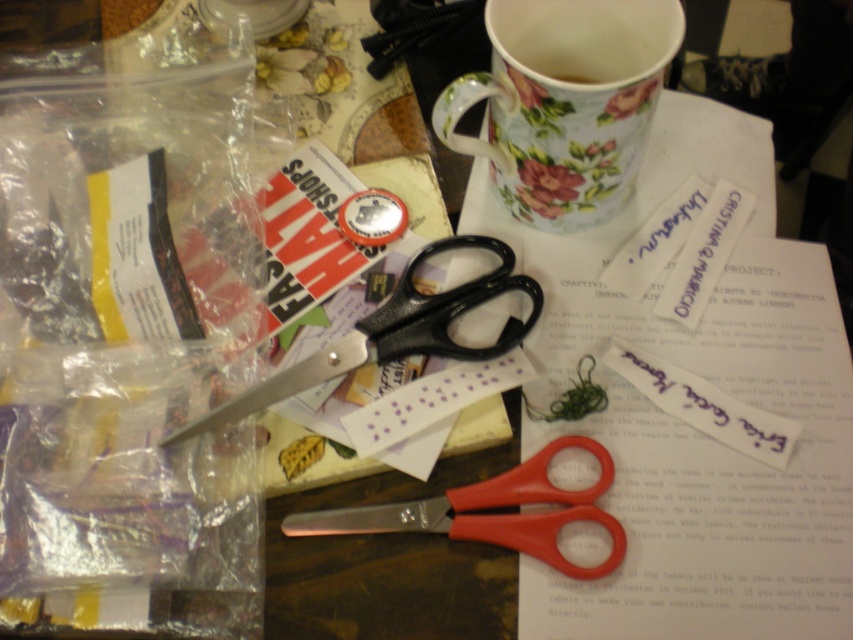
Where is `white paper at upper center`? white paper at upper center is located at coordinates (688, 422).

Between white paper at upper center and floral ceramic mug at upper center, which one is positioned higher?

floral ceramic mug at upper center is above.

Is point (706, 496) closer to camera compared to point (573, 84)?

That is False.

This screenshot has width=853, height=640. I want to click on white paper at upper center, so click(x=688, y=422).

In the scene shown: Is metallic red scissors at center wider than black plastic scissors at center?

No, metallic red scissors at center is not wider than black plastic scissors at center.

Which is above, metallic red scissors at center or black plastic scissors at center?

black plastic scissors at center is above.

Where is `metallic red scissors at center`? This screenshot has width=853, height=640. metallic red scissors at center is located at coordinates (492, 513).

What are the coordinates of `metallic red scissors at center` in the screenshot? It's located at (492, 513).

Does point (575, 332) come farther from viewer compared to point (416, 257)?

No, it is not.

Between white paper at upper center and black plastic scissors at center, which one appears on the left side from the viewer's perspective?

Positioned to the left is black plastic scissors at center.

Where is `white paper at upper center`? The width and height of the screenshot is (853, 640). white paper at upper center is located at coordinates (688, 422).

Where is `white paper at upper center`? The height and width of the screenshot is (640, 853). white paper at upper center is located at coordinates (688, 422).